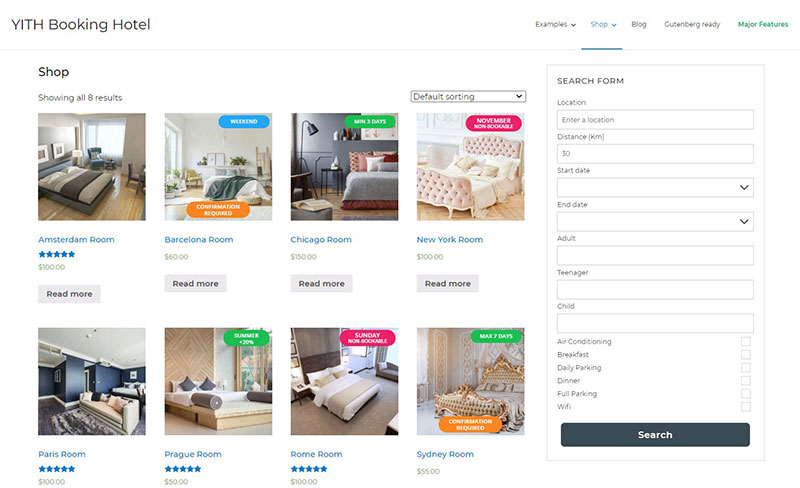
This screenshot has height=488, width=800. Find the location of `floor`. floor is located at coordinates (122, 205), (194, 193), (332, 201), (506, 215), (50, 405), (176, 428), (378, 420), (430, 422).